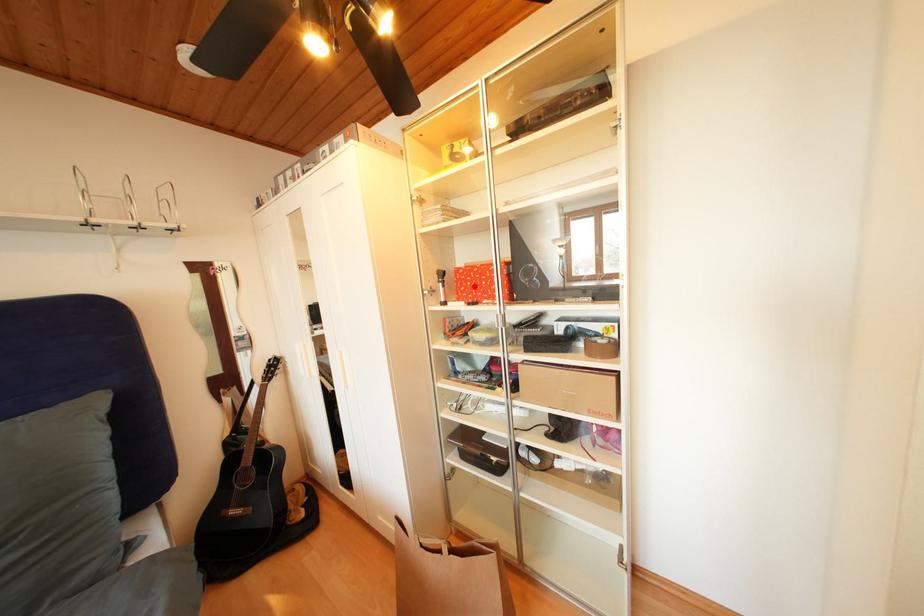
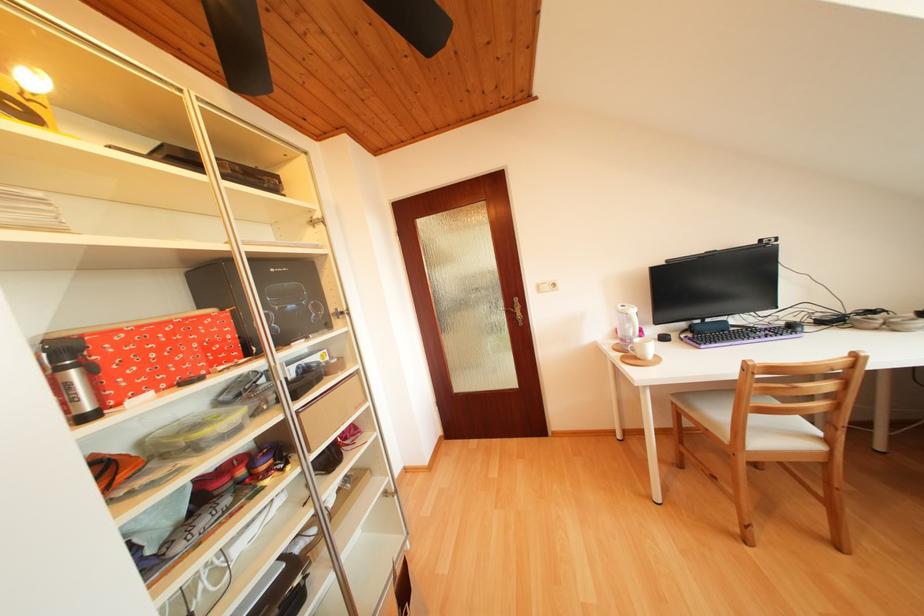
Find the pixel in the second image that matches the highlighted location in the first image.

(151, 358)